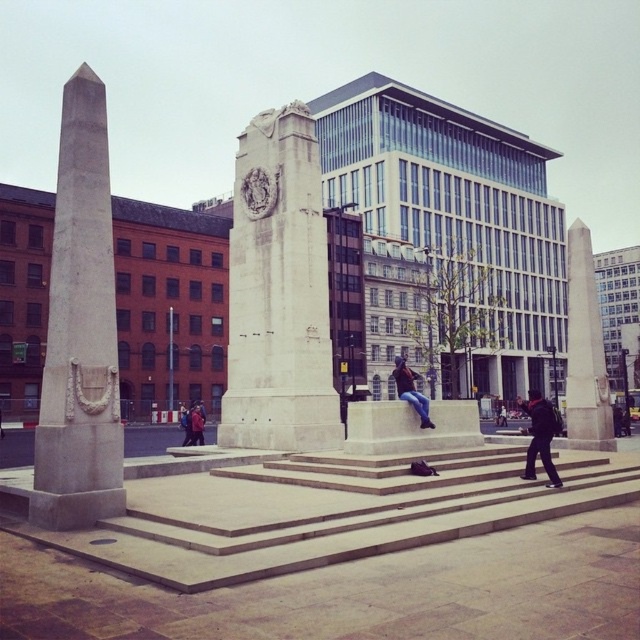
You are standing in the public square and want to take a photo of both the white stone monument at center and the denim jeans at center. Which object should you focus on first to ensure it appears larger in your photo?

The white stone monument at center is much taller than the denim jeans at center, so you should focus on the white stone monument at center first to capture its larger size in the photo.